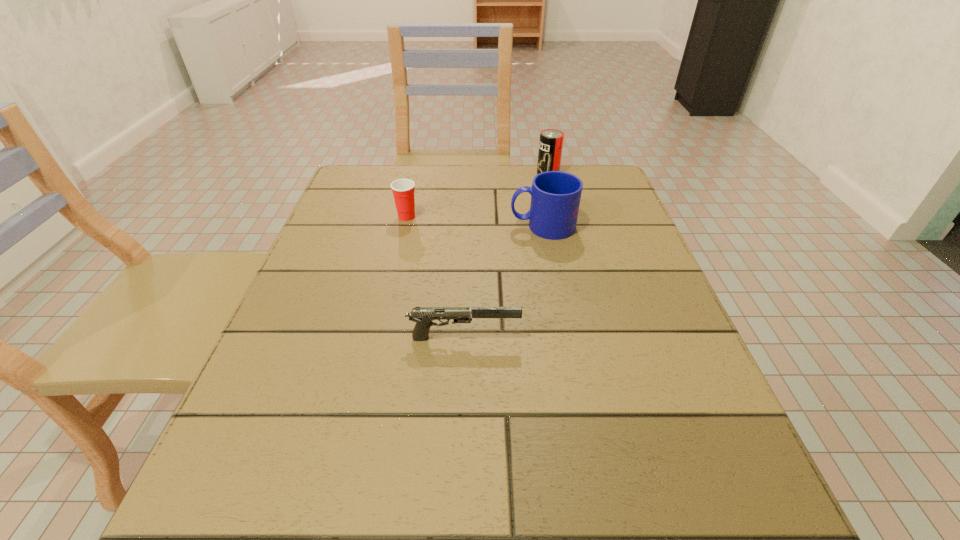
The image size is (960, 540). Find the location of `vacant area between the Dixie cup and the can`. vacant area between the Dixie cup and the can is located at coordinates (477, 195).

The height and width of the screenshot is (540, 960). I want to click on unoccupied area between the leftmost object and the farthest object, so click(x=477, y=195).

You are a GUI agent. You are given a task and a screenshot of the screen. Output one action in this format:
    pyautogui.click(x=<x>, y=<y>)
    Task: Click on the vacant area that lies between the farthest object and the nearest object
    Image resolution: width=960 pixels, height=540 pixels.
    Given the screenshot: What is the action you would take?
    pyautogui.click(x=506, y=255)

At what (x,y) coordinates should I click in order to perform the action: click on object that is the closest to the Dixie cup. Please return your answer as a coordinate pair (x, y). Image resolution: width=960 pixels, height=540 pixels. Looking at the image, I should click on (555, 195).

I want to click on the closest object to the can, so click(555, 195).